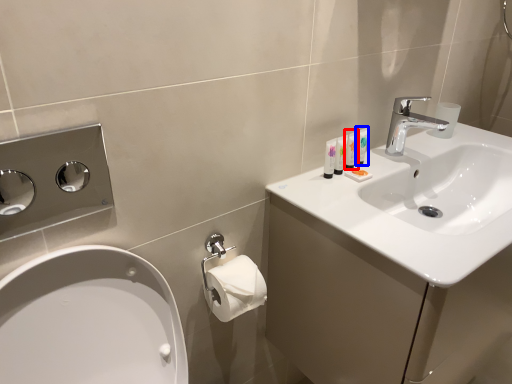
Question: Which object appears closest to the camera in this image, mouthwash (highlighted by a red box) or mouthwash (highlighted by a blue box)?

Choices:
 (A) mouthwash
 (B) mouthwash

Answer: (A)